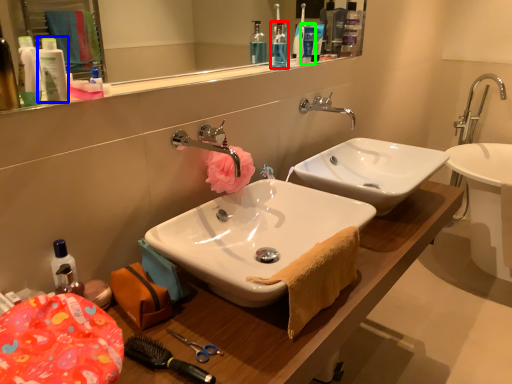
Question: Based on their relative distances, which object is farther from mouthwash (highlighted by a red box)? Choose from toiletry (highlighted by a blue box) and toiletry (highlighted by a green box).

Choices:
 (A) toiletry
 (B) toiletry

Answer: (A)